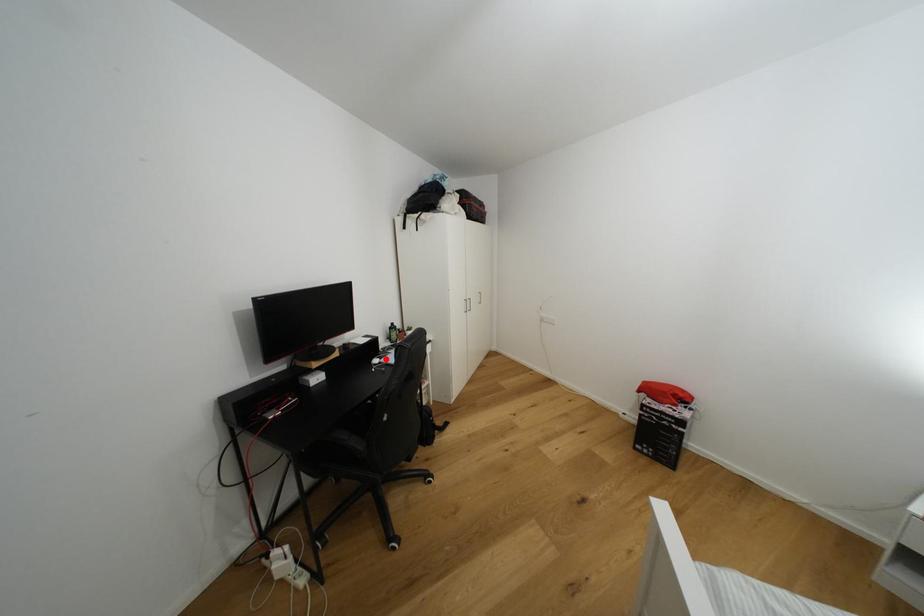
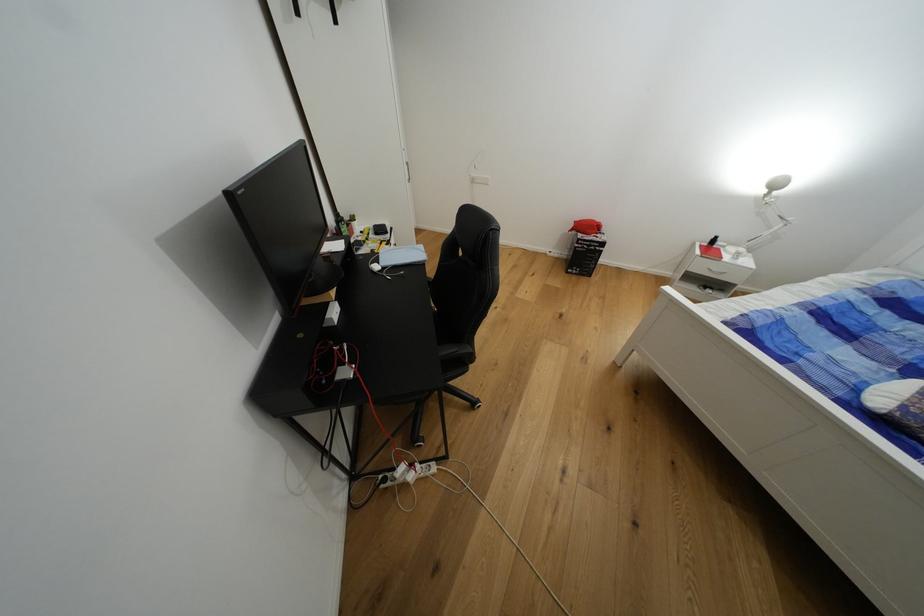
Question: I am providing you with two images of the same scene from different viewpoints. In image1, a red point is highlighted. Considering the same 3D point in image2, which of the following is correct?

Choices:
 (A) It is closer
 (B) It is farther

Answer: (A)